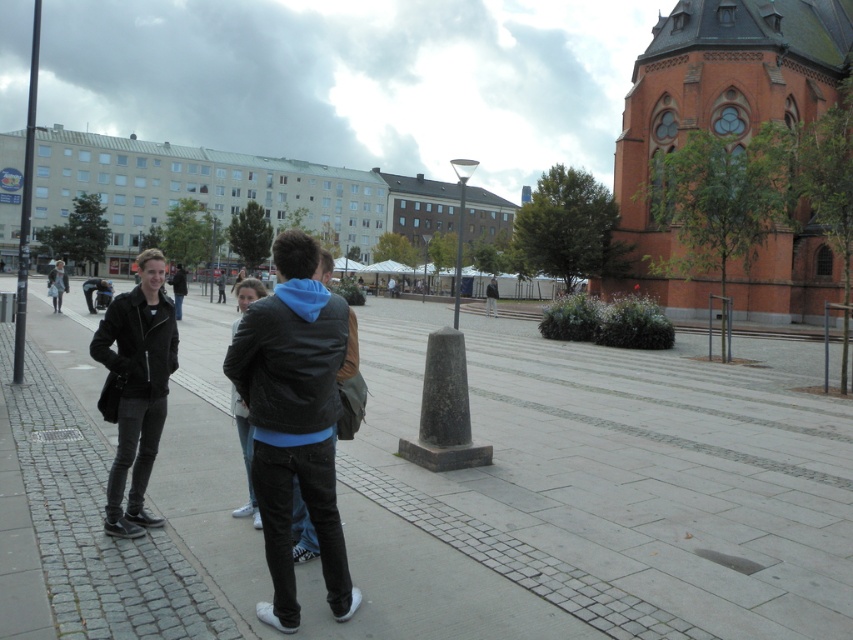
You are standing in the public square and want to move from the group of people on the left to the row of trees in the background. There are two points marked on your path. Which point, point 1 at coordinates (x=143, y=340) or point 2 at coordinates (x=257, y=522), is closer to you as you walk towards the trees?

Point 1 at coordinates (x=143, y=340) is closer to you than point 2 at coordinates (x=257, y=522) as you walk towards the trees because the description states that point (x=143, y=340) is closer to the viewer than point (x=257, y=522).